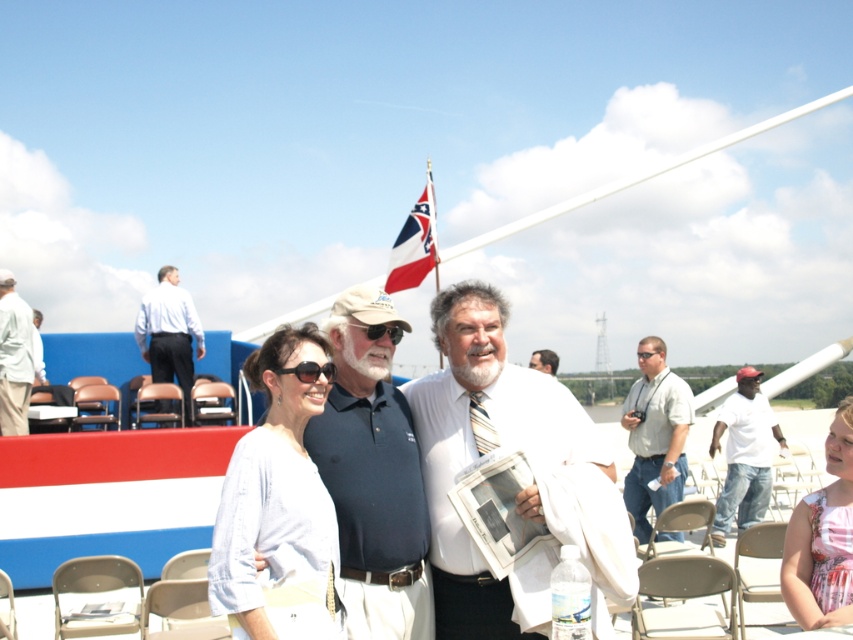
Question: Is white cotton shirt at right bigger than red-white striped flag at upper center?

Choices:
 (A) yes
 (B) no

Answer: (A)

Question: Which object appears farthest from the camera in this image?

Choices:
 (A) light blue fabric blouse at center
 (B) light blue shirt at left
 (C) light brown leather jacket at center

Answer: (B)

Question: Can you confirm if light blue fabric blouse at center is positioned above light brown leather jacket at center?

Choices:
 (A) yes
 (B) no

Answer: (B)

Question: Can you confirm if white striped tie at center is positioned below light brown leather jacket at center?

Choices:
 (A) no
 (B) yes

Answer: (B)

Question: Which object is positioned closest to the black plastic sunglasses at center?

Choices:
 (A) red-white striped flag at upper center
 (B) dark blue polo shirt at center
 (C) white striped tie at center
 (D) matte white shirt at center

Answer: (B)

Question: Which point is closer to the camera taking this photo?

Choices:
 (A) (834, 545)
 (B) (271, 627)
 (C) (531, 508)
 (D) (368, 333)

Answer: (B)